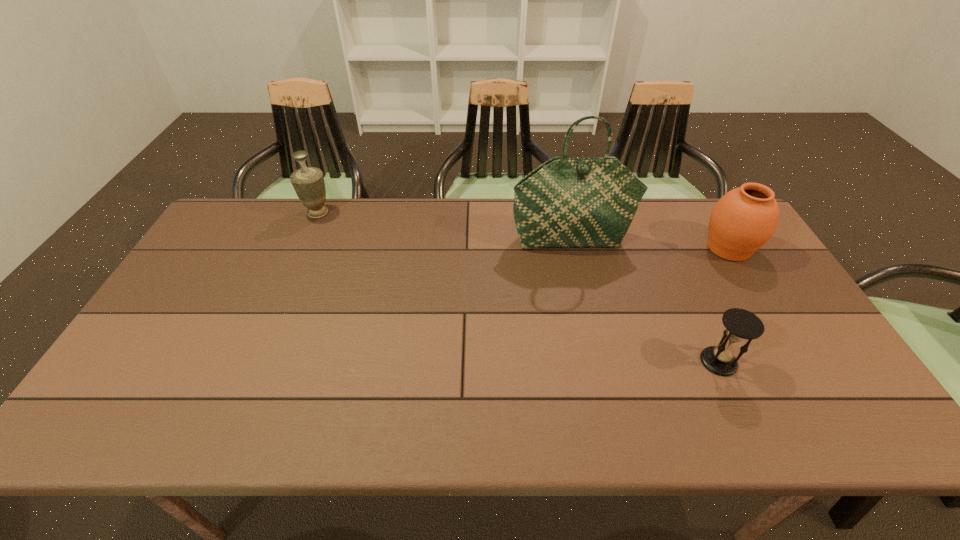
Locate an element on the screen. the second object from left to right is located at coordinates (566, 202).

Locate an element on the screen. the tallest object is located at coordinates (566, 202).

Locate an element on the screen. This screenshot has height=540, width=960. the leftmost object is located at coordinates (308, 182).

I want to click on the farthest object, so click(x=308, y=182).

Identify the location of the rightmost object. The image size is (960, 540). (744, 219).

Find the location of a particular element. This screenshot has height=540, width=960. the right urn is located at coordinates (744, 219).

Where is `the nearest object`? the nearest object is located at coordinates (740, 324).

Where is `hourglass`? The image size is (960, 540). hourglass is located at coordinates (740, 324).

I want to click on blank area located 0.070m on the back of the second object from left to right, so click(x=565, y=217).

Locate an element on the screen. The height and width of the screenshot is (540, 960). vacant space located on the front of the farthest object is located at coordinates (297, 263).